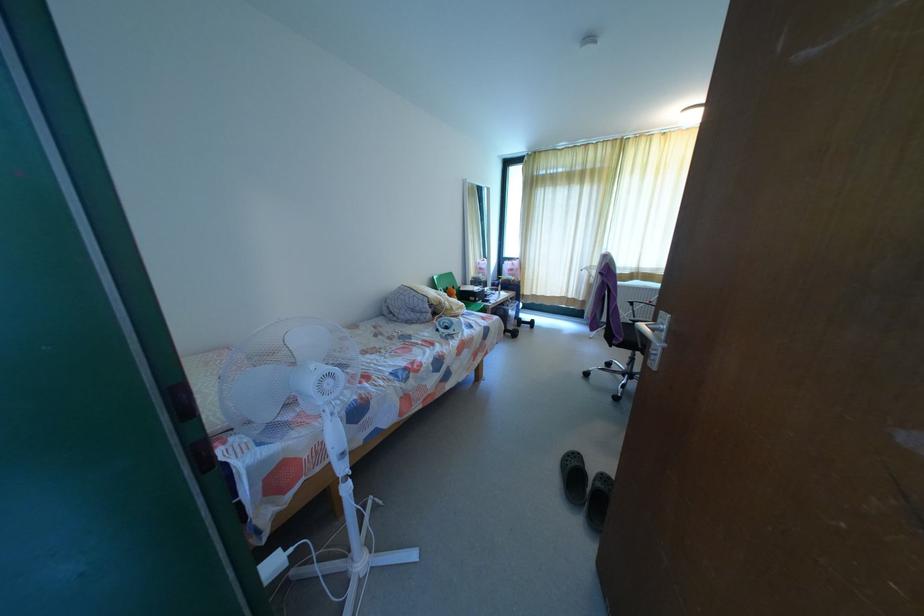
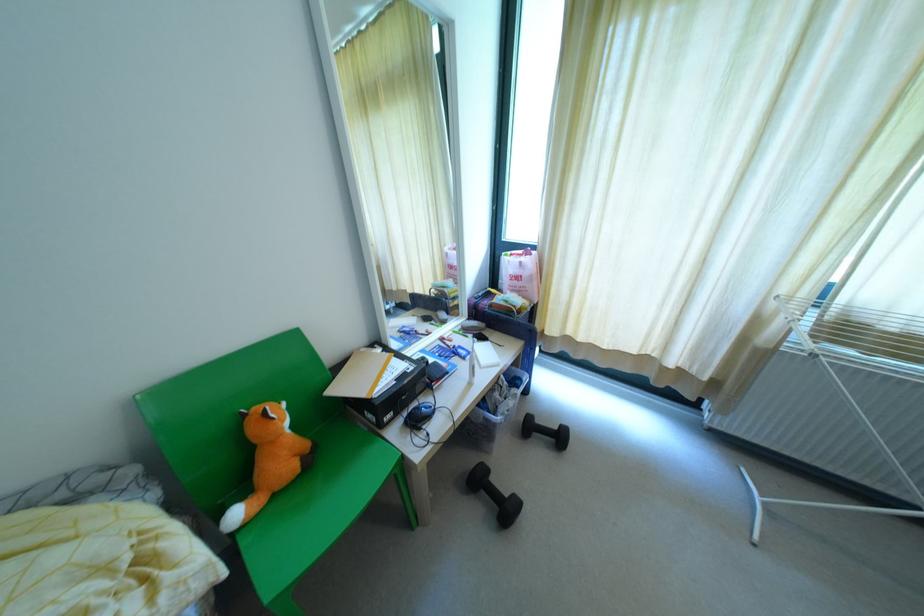
Find the pixel in the second image that matches [518,322] in the first image.

(529, 428)